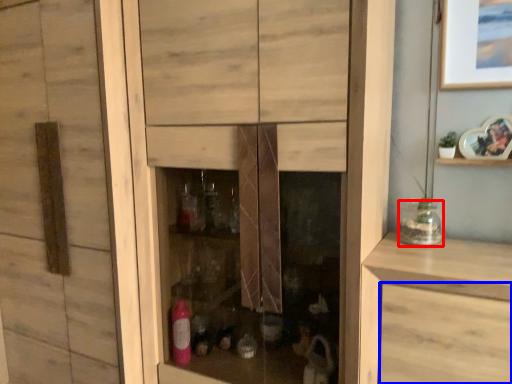
Question: Among these objects, which one is farthest to the camera, glass jar (highlighted by a red box) or drawer (highlighted by a blue box)?

Choices:
 (A) glass jar
 (B) drawer

Answer: (A)